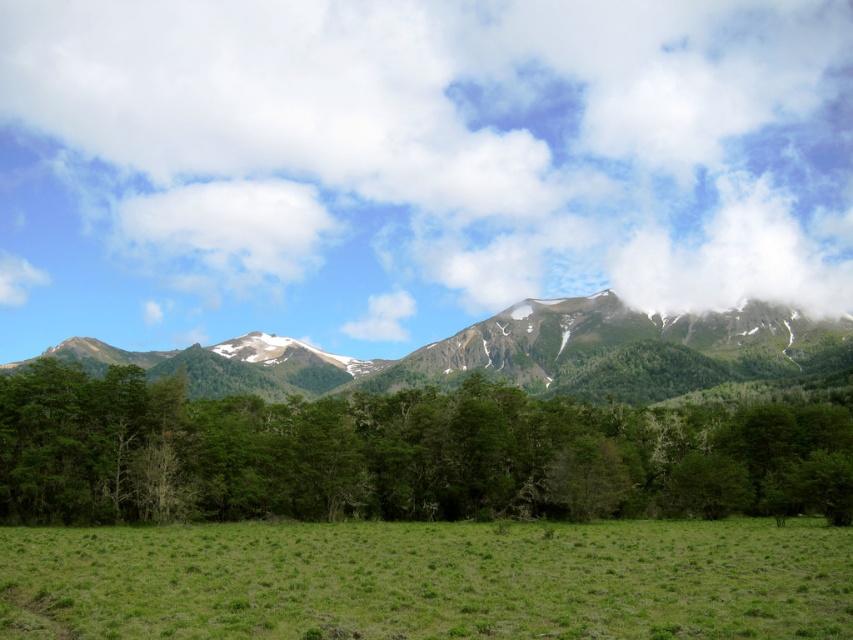
Question: Considering the relative positions of green leafy tree at center and green grassy field at lower center in the image provided, where is green leafy tree at center located with respect to green grassy field at lower center?

Choices:
 (A) below
 (B) above

Answer: (A)

Question: Is green grassy field at lower center below green textured mountain range at center?

Choices:
 (A) yes
 (B) no

Answer: (B)

Question: Which object is positioned farthest from the white fluffy cloud at upper center?

Choices:
 (A) green leafy tree at center
 (B) green grassy field at lower center

Answer: (B)

Question: Considering the relative positions of white fluffy cloud at upper center and green textured mountain range at center in the image provided, where is white fluffy cloud at upper center located with respect to green textured mountain range at center?

Choices:
 (A) left
 (B) right

Answer: (A)

Question: Among these points, which one is farthest from the camera?

Choices:
 (A) (258, 349)
 (B) (733, 628)
 (C) (440, 67)
 (D) (822, 490)

Answer: (C)

Question: Considering the real-world distances, which object is closest to the white fluffy cloud at upper center?

Choices:
 (A) green leafy tree at center
 (B) green grassy field at lower center
 (C) green textured mountain range at center

Answer: (C)